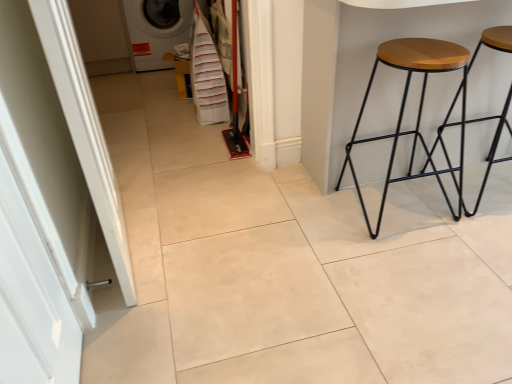
Find the location of a particular element. The image size is (512, 384). free space in front of white fabric laundry at center is located at coordinates (199, 130).